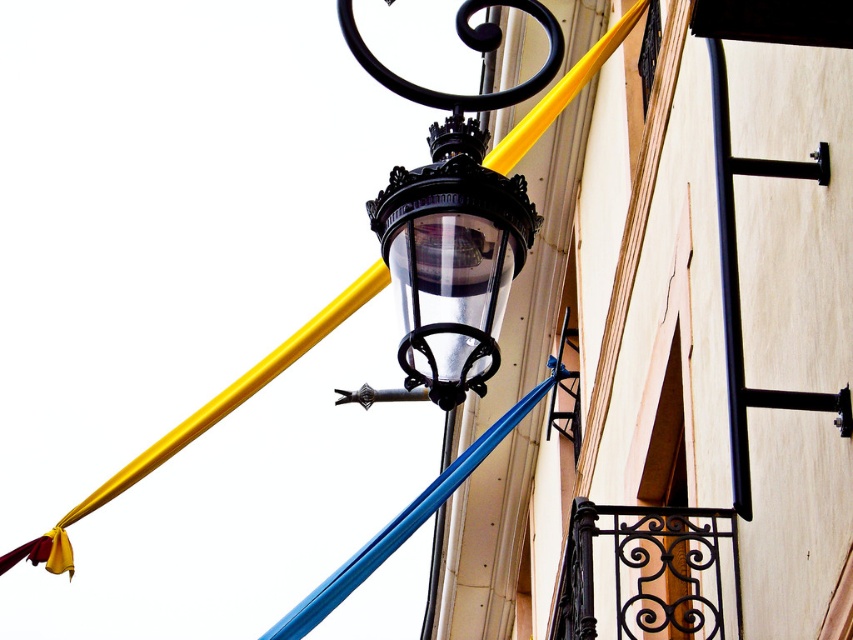
Is black glass lantern at center further to camera compared to black metal pole at upper center?

No.

Is point (415, 394) farther from camera compared to point (527, 148)?

That is True.

Does point (442, 148) come in front of point (222, 392)?

Yes, point (442, 148) is in front of point (222, 392).

Where is `black glass lantern at center`? Image resolution: width=853 pixels, height=640 pixels. black glass lantern at center is located at coordinates (450, 262).